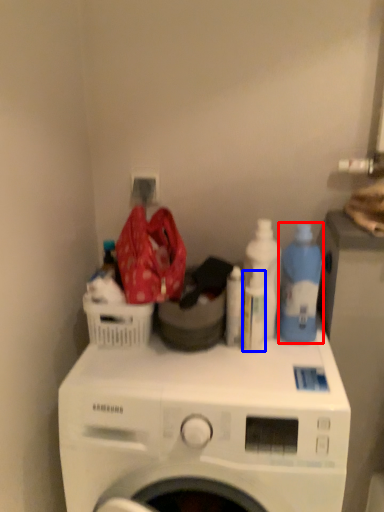
Question: Which of the following is the closest to the observer, cleaning product (highlighted by a red box) or bottle (highlighted by a blue box)?

Choices:
 (A) cleaning product
 (B) bottle

Answer: (A)